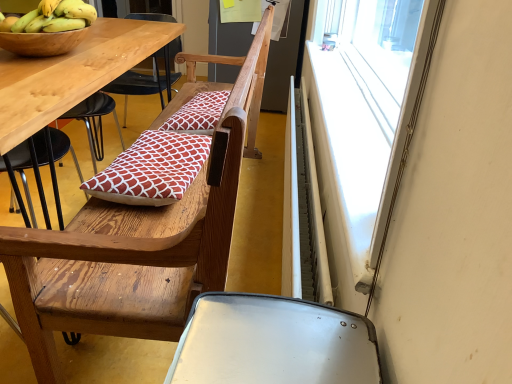
Question: In terms of height, does yellow matte bananas at upper left look taller or shorter compared to red printed cushion at center, which appears as the 2th pillow when ordered from the bottom?

Choices:
 (A) tall
 (B) short

Answer: (A)

Question: From a real-world perspective, is yellow matte bananas at upper left physically located above or below red printed cushion at center, which is counted as the second pillow, starting from the front?

Choices:
 (A) above
 (B) below

Answer: (A)

Question: Which object is positioned closest to the wooden chair at center?

Choices:
 (A) yellow matte bananas at upper left
 (B) red printed cushion at center, the 2th pillow when ordered from top to bottom
 (C) white metallic radiator at right
 (D) red printed cushion at center, the 1th pillow viewed from the top
 (E) white plastic window at upper right

Answer: (B)

Question: Which of these objects is positioned farthest from the white metallic radiator at right?

Choices:
 (A) yellow matte bananas at upper left
 (B) red printed cushion at center, the 2th pillow when ordered from top to bottom
 (C) wooden chair at center
 (D) white plastic window at upper right
 (E) red printed cushion at center, which is the first pillow in back-to-front order

Answer: (A)